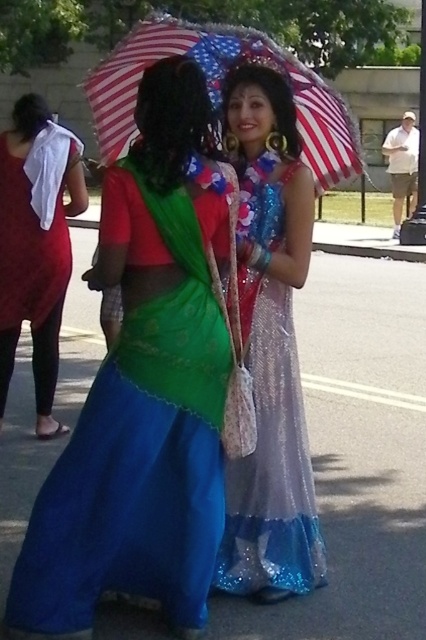
Question: Which of the following is the closest to the observer?

Choices:
 (A) shiny green fabric at center
 (B) sparkly silver dress at center
 (C) american flag fabric umbrella at upper center

Answer: (A)

Question: Which object is farther from the camera taking this photo?

Choices:
 (A) shiny green fabric at center
 (B) matte red dress at left
 (C) american flag fabric umbrella at upper center
 (D) sparkly silver dress at center

Answer: (B)

Question: Which point is farther from the camera taking this photo?

Choices:
 (A) (74, 209)
 (B) (178, 413)
 (C) (109, 93)

Answer: (A)

Question: Is matte red dress at left bigger than american flag fabric umbrella at upper center?

Choices:
 (A) yes
 (B) no

Answer: (B)

Question: From the image, what is the correct spatial relationship of shiny green fabric at center in relation to matte red dress at left?

Choices:
 (A) right
 (B) left

Answer: (A)

Question: Does matte red dress at left appear on the left side of american flag fabric umbrella at upper center?

Choices:
 (A) yes
 (B) no

Answer: (A)